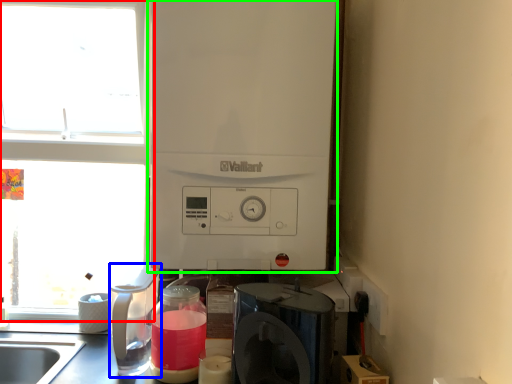
Question: Based on their relative distances, which object is farther from window (highlighted by a red box)? Choose from kitchen appliance (highlighted by a blue box) and appliance (highlighted by a green box).

Choices:
 (A) kitchen appliance
 (B) appliance

Answer: (B)